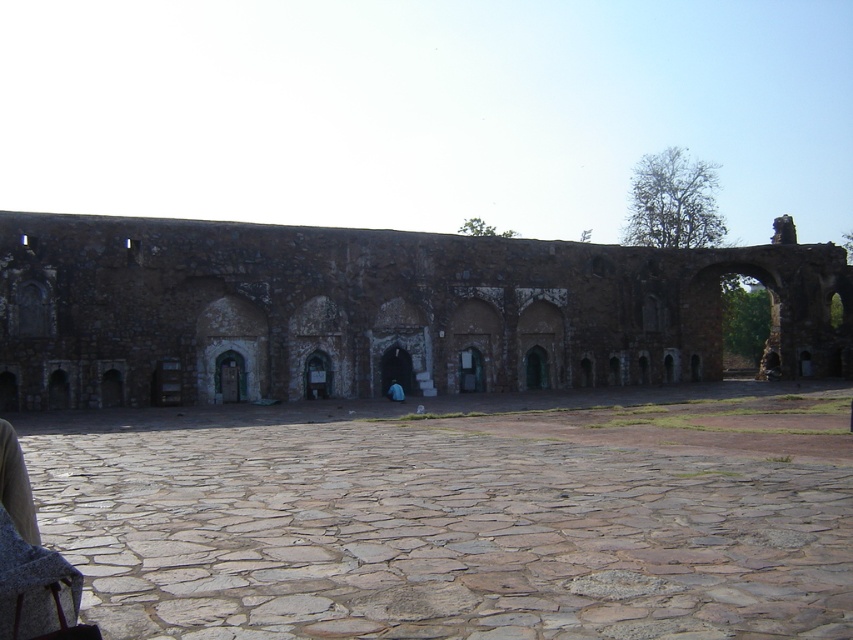
You are standing in the courtyard and want to climb up to the top of the rustic stone wall at center. Can you step directly from the stone paved courtyard at center onto the wall?

The stone paved courtyard at center is below rustic stone wall at center, so you can step directly from the stone paved courtyard at center onto the wall since they are adjacent vertically.

Based on the scene description, where is the point located at coordinates (459, 515)?

The point at coordinates (459, 515) is located on the stone paved courtyard at center.

You are standing in the courtyard and see two points marked on the ground. The first point is at coordinates point (538, 634) and the second is at point (813, 372). Which point is closer to you?

Point (538, 634) is in front of point (813, 372), so it is closer to you.